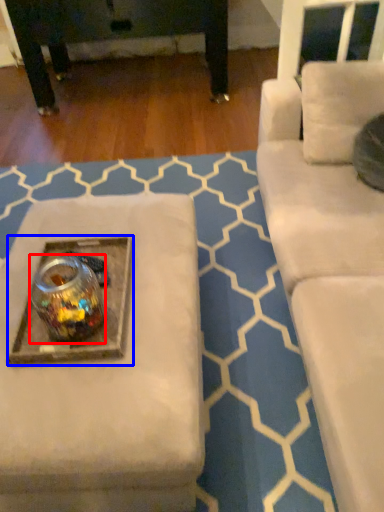
Question: Which object is closer to the camera taking this photo, beverage (highlighted by a red box) or round table (highlighted by a blue box)?

Choices:
 (A) beverage
 (B) round table

Answer: (A)